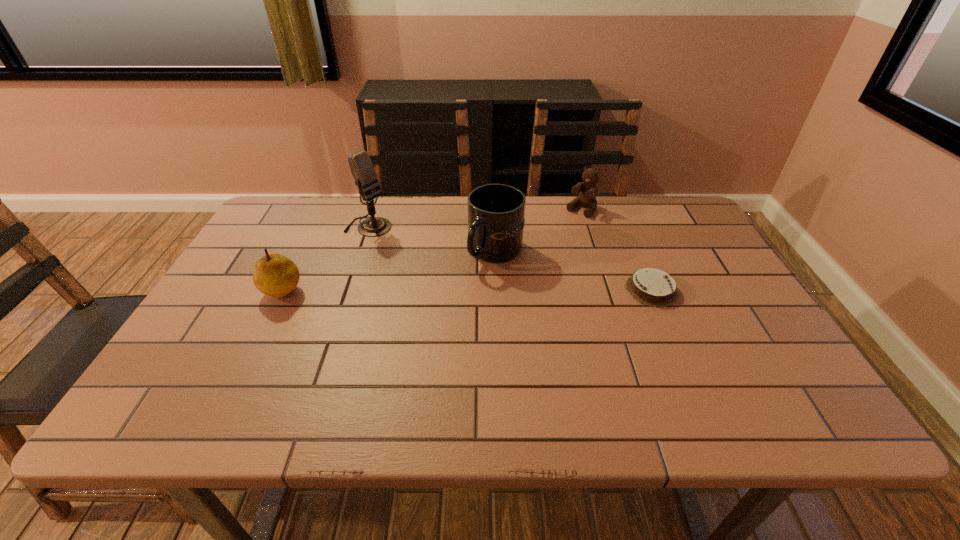
Locate an element on the screen. This screenshot has width=960, height=540. vacant region located 0.310m with the handle on the side of the second tallest object is located at coordinates (374, 319).

The image size is (960, 540). Find the location of `blank space located 0.340m with the handle on the side of the second tallest object`. blank space located 0.340m with the handle on the side of the second tallest object is located at coordinates (363, 325).

Find the location of a particular element. This screenshot has height=540, width=960. vacant area situated 0.160m on the face of the teddy bear is located at coordinates pyautogui.click(x=548, y=242).

Locate an element on the screen. vacant space located 0.260m on the face of the teddy bear is located at coordinates (531, 259).

You are a GUI agent. You are given a task and a screenshot of the screen. Output one action in this format:
    pyautogui.click(x=<x>, y=<y>)
    Task: Click on the blank space located 0.070m on the face of the teddy bear
    
    Given the screenshot: What is the action you would take?
    pos(564,227)

Image resolution: width=960 pixels, height=540 pixels. Identify the location of vacant position located on the front-facing side of the microphone. (482, 286).

Locate an element on the screen. free space located 0.360m on the front-facing side of the microphone is located at coordinates (479, 284).

Identify the location of vacant space located 0.370m on the front-facing side of the microphone. (482, 286).

At what (x,y) coordinates should I click in order to perform the action: click on mug that is at the far edge. Please return your answer as a coordinate pair (x, y). The image size is (960, 540). Looking at the image, I should click on (496, 212).

The image size is (960, 540). I want to click on teddy bear that is at the far edge, so click(x=587, y=197).